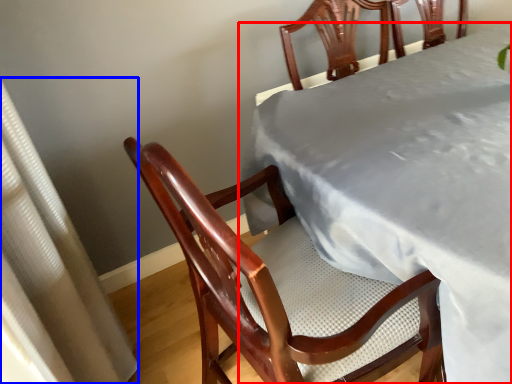
Question: Among these objects, which one is nearest to the camera, table (highlighted by a red box) or curtain (highlighted by a blue box)?

Choices:
 (A) table
 (B) curtain

Answer: (B)